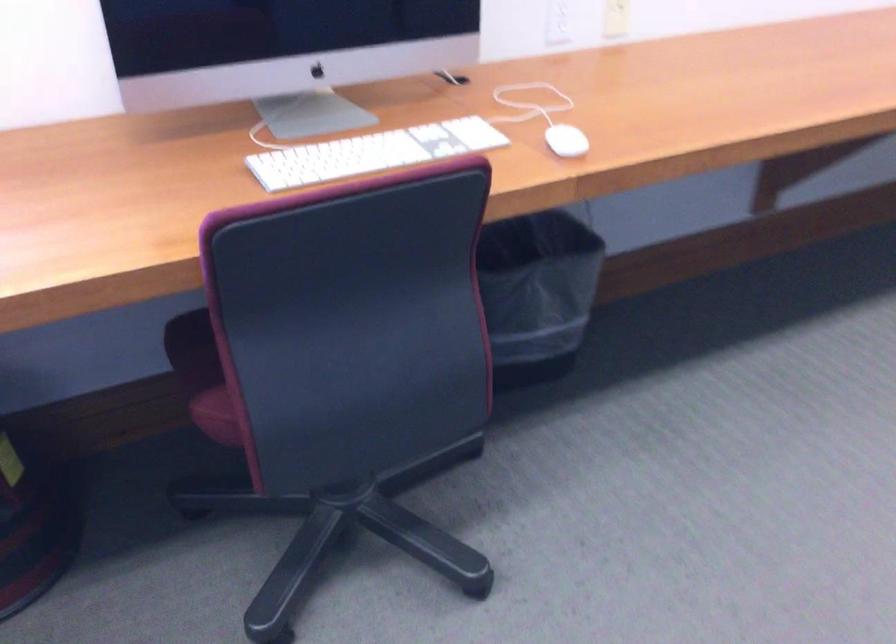
This screenshot has width=896, height=644. What are the coordinates of `white computer keyboard` in the screenshot? It's located at (372, 153).